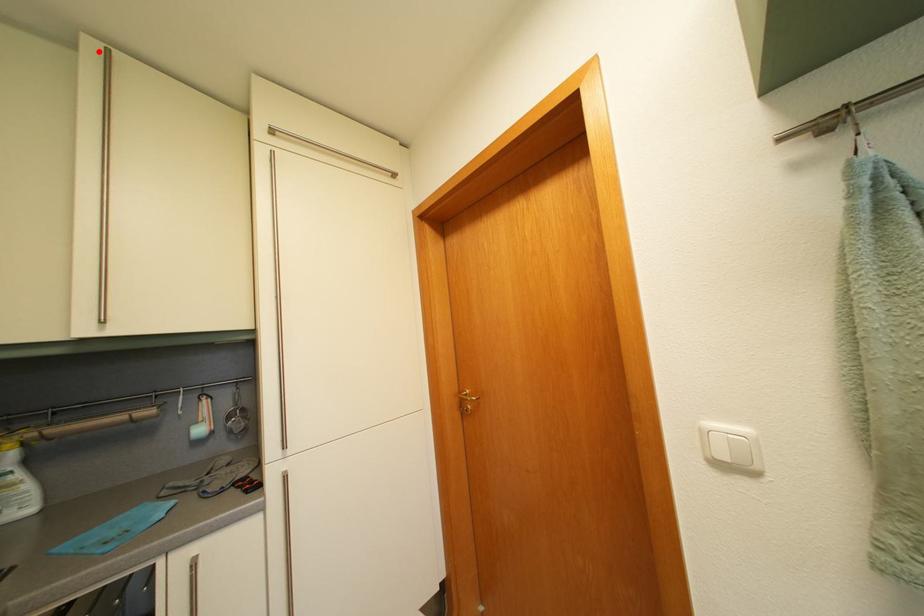
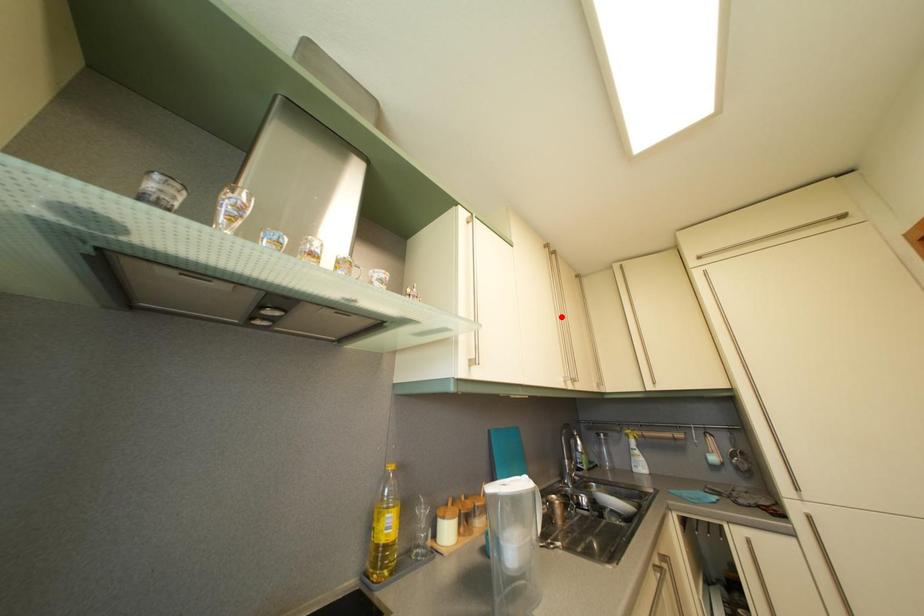
I am providing you with two images of the same scene from different viewpoints. A red point is marked on the first image and another point is marked on the second image. Is the red point in image1 aligned with the point shown in image2?

No